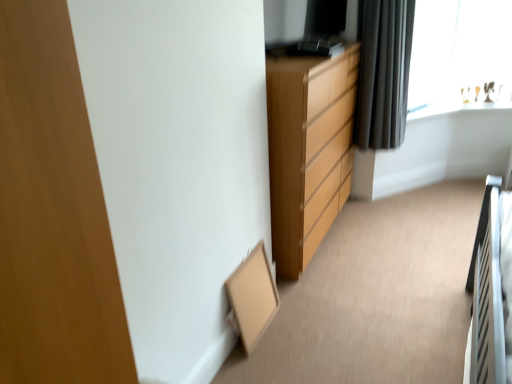
Describe the element at coordinates (383, 72) in the screenshot. I see `black fabric curtain at upper right` at that location.

In order to face black fabric curtain at upper right, should I rotate leftwards or rightwards?

Turn right by 16.546 degrees to look at black fabric curtain at upper right.

The height and width of the screenshot is (384, 512). In order to click on black fabric curtain at upper right in this screenshot , I will do `click(383, 72)`.

Which of these two, black fabric curtain at upper right or transparent glass window at upper right, is bigger?

With larger size is black fabric curtain at upper right.

Which is in front, black fabric curtain at upper right or transparent glass window at upper right?

black fabric curtain at upper right is more forward.

From the image's perspective, relative to transparent glass window at upper right, is black fabric curtain at upper right above or below?

Based on their image positions, black fabric curtain at upper right is located beneath transparent glass window at upper right.

Identify the location of curtain that appears on the left of transparent glass window at upper right. This screenshot has width=512, height=384. (383, 72).

Consider the image. Who is shorter, transparent glass window at upper right or black fabric curtain at upper right?

transparent glass window at upper right.

Which is farther, (413,84) or (381,33)?

Point (413,84)

What's the angular difference between transparent glass window at upper right and black fabric curtain at upper right's facing directions?

21.6 degrees separate the facing orientations of transparent glass window at upper right and black fabric curtain at upper right.

Is point (393, 23) positioned before point (298, 243)?

No, it is behind (298, 243).

From the image's perspective, which object appears higher, black fabric curtain at upper right or matte wood chest of drawers at center?

black fabric curtain at upper right, from the image's perspective.

Is black fabric curtain at upper right thinner than matte wood chest of drawers at center?

Yes, black fabric curtain at upper right is thinner than matte wood chest of drawers at center.

Is black fabric curtain at upper right looking in the opposite direction of matte wood chest of drawers at center?

No, black fabric curtain at upper right's orientation is not away from matte wood chest of drawers at center.

How many degrees apart are the facing directions of transparent glass window at upper right and matte wood chest of drawers at center?

There is a 64.6-degree angle between the facing directions of transparent glass window at upper right and matte wood chest of drawers at center.

Which object is further away from the camera taking this photo, transparent glass window at upper right or matte wood chest of drawers at center?

transparent glass window at upper right is more distant.

In the scene shown: Is transparent glass window at upper right thinner than matte wood chest of drawers at center?

Yes, transparent glass window at upper right is thinner than matte wood chest of drawers at center.

Which is more to the left, transparent glass window at upper right or matte wood chest of drawers at center?

From the viewer's perspective, matte wood chest of drawers at center appears more on the left side.

Which of these two, matte wood chest of drawers at center or black fabric curtain at upper right, is smaller?

black fabric curtain at upper right is smaller.

Is black fabric curtain at upper right a part of matte wood chest of drawers at center?

Definitely not — black fabric curtain at upper right is not inside matte wood chest of drawers at center.

From the picture: Is matte wood chest of drawers at center facing towards black fabric curtain at upper right?

Yes, matte wood chest of drawers at center is facing black fabric curtain at upper right.

How far apart are matte wood chest of drawers at center and black fabric curtain at upper right?

matte wood chest of drawers at center and black fabric curtain at upper right are 22.66 inches apart from each other.

Can you see matte wood chest of drawers at center touching transparent glass window at upper right?

No, matte wood chest of drawers at center is not with transparent glass window at upper right.

Considering the relative positions of matte wood chest of drawers at center and transparent glass window at upper right in the image provided, is matte wood chest of drawers at center to the left or to the right of transparent glass window at upper right?

matte wood chest of drawers at center is to the left of transparent glass window at upper right.

From a real-world perspective, who is located lower, matte wood chest of drawers at center or transparent glass window at upper right?

In real-world perspective, matte wood chest of drawers at center is lower.

Is transparent glass window at upper right a part of matte wood chest of drawers at center?

Actually, transparent glass window at upper right is outside matte wood chest of drawers at center.

This screenshot has width=512, height=384. In the image, there is a black fabric curtain at upper right. What are the coordinates of `window above it (from the image's perspective)` in the screenshot? It's located at (459, 49).

Identify the location of curtain that is below the transparent glass window at upper right (from the image's perspective). Image resolution: width=512 pixels, height=384 pixels. (383, 72).

Consider the image. Which object lies further to the anchor point transparent glass window at upper right, matte wood chest of drawers at center or black fabric curtain at upper right?

The object further to transparent glass window at upper right is matte wood chest of drawers at center.

Looking at this image, estimate the real-world distances between objects in this image. Which object is closer to black fabric curtain at upper right, matte wood chest of drawers at center or transparent glass window at upper right?

matte wood chest of drawers at center lies closer to black fabric curtain at upper right than the other object.

Considering their positions, is black fabric curtain at upper right positioned closer to transparent glass window at upper right than matte wood chest of drawers at center?

black fabric curtain at upper right.

Considering their positions, is transparent glass window at upper right positioned further to matte wood chest of drawers at center than black fabric curtain at upper right?

Among the two, transparent glass window at upper right is located further to matte wood chest of drawers at center.

When comparing their distances from matte wood chest of drawers at center, does black fabric curtain at upper right or transparent glass window at upper right seem further?

transparent glass window at upper right is positioned further to the anchor matte wood chest of drawers at center.

Based on their spatial positions, is transparent glass window at upper right or matte wood chest of drawers at center further from black fabric curtain at upper right?

transparent glass window at upper right is positioned further to the anchor black fabric curtain at upper right.

The width and height of the screenshot is (512, 384). In order to click on curtain located between matte wood chest of drawers at center and transparent glass window at upper right in the left-right direction in this screenshot , I will do `click(383, 72)`.